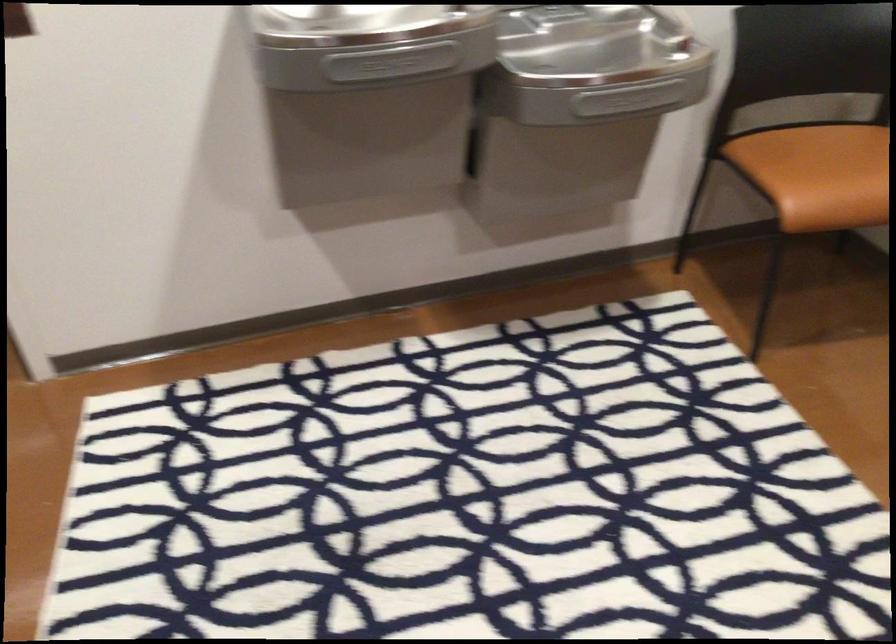
The image size is (896, 644). I want to click on chair sitting surface, so click(x=821, y=174).